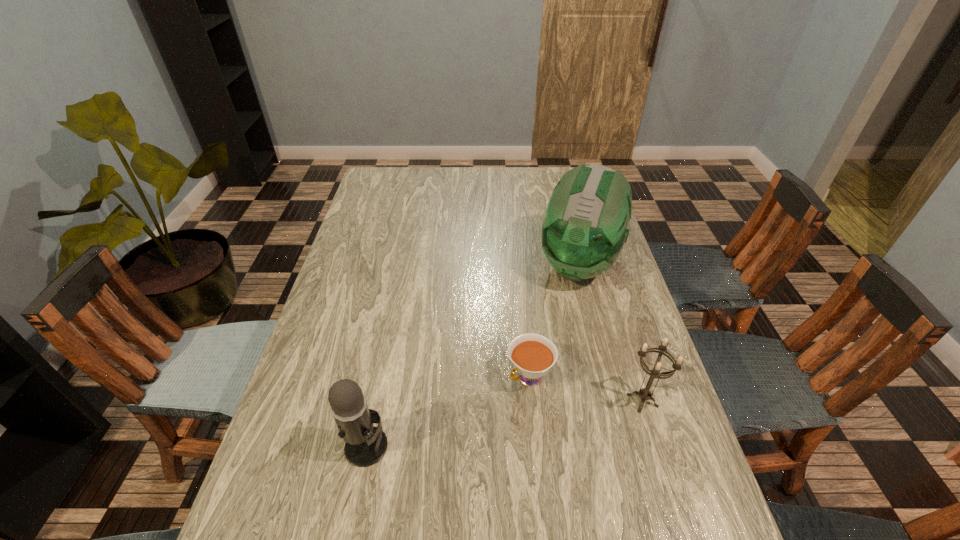
This screenshot has width=960, height=540. What are the coordinates of `blank space at the far left corner of the desktop` in the screenshot? It's located at (376, 180).

I want to click on vacant space at the near left corner of the desktop, so click(300, 509).

Image resolution: width=960 pixels, height=540 pixels. Identify the location of blank region between the leftmost object and the farthest object. (472, 355).

Identify the location of free area in between the shortest object and the leftmost object. This screenshot has width=960, height=540. (447, 412).

Identify the location of free space between the candle holder and the football helmet. This screenshot has width=960, height=540. (611, 332).

At what (x,y) coordinates should I click in order to perform the action: click on free space that is in between the farthest object and the nearest object. Please return your answer as a coordinate pair (x, y). The height and width of the screenshot is (540, 960). Looking at the image, I should click on [x=472, y=355].

Where is `blank region between the football helmet and the teacup`? This screenshot has height=540, width=960. blank region between the football helmet and the teacup is located at coordinates (554, 321).

Find the location of `vacant space in between the microphone and the tallest object`. vacant space in between the microphone and the tallest object is located at coordinates (472, 355).

Identify the location of vacant space in between the tallest object and the teacup. Image resolution: width=960 pixels, height=540 pixels. (554, 321).

Identify the location of free space that is in between the nearest object and the third tallest object. (504, 423).